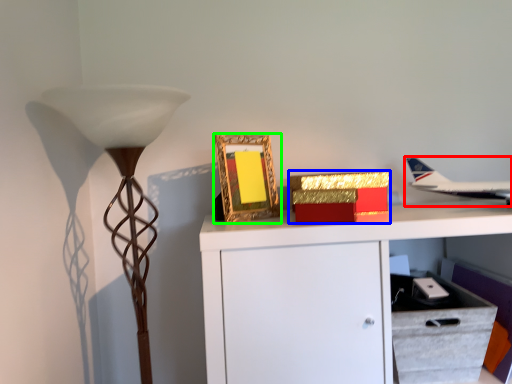
Question: Which object is positioned closest to airplane (highlighted by a red box)? Select from box (highlighted by a blue box) and picture frame (highlighted by a green box).

Choices:
 (A) box
 (B) picture frame

Answer: (A)